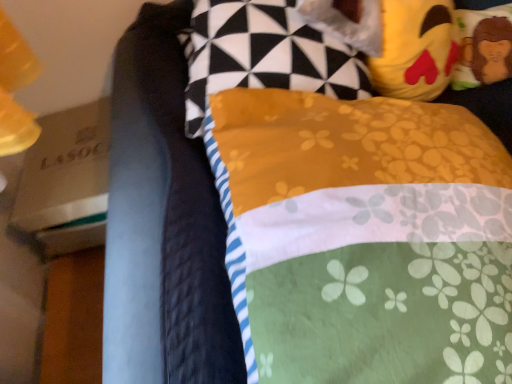
Question: Is yellow fabric pillow at upper center, the 1th pillow when ordered from left to right, taller than yellow plush toy at upper right?

Choices:
 (A) yes
 (B) no

Answer: (A)

Question: From the image's perspective, is yellow fabric pillow at upper center, which appears as the 3th pillow when viewed from the right, under yellow plush toy at upper right?

Choices:
 (A) no
 (B) yes

Answer: (B)

Question: Considering the relative positions of yellow fabric pillow at upper center, the 1th pillow when ordered from left to right, and yellow plush toy at upper right in the image provided, is yellow fabric pillow at upper center, the 1th pillow when ordered from left to right, behind yellow plush toy at upper right?

Choices:
 (A) no
 (B) yes

Answer: (A)

Question: Can you confirm if yellow fabric pillow at upper center, the 1th pillow when ordered from left to right, is shorter than yellow plush toy at upper right?

Choices:
 (A) no
 (B) yes

Answer: (A)

Question: Can you confirm if yellow fabric pillow at upper center, the 1th pillow when ordered from left to right, is thinner than yellow plush toy at upper right?

Choices:
 (A) no
 (B) yes

Answer: (A)

Question: Is yellow fabric pillow at upper right, which is counted as the 2th pillow, starting from the right, bigger or smaller than yellow fabric pillow at upper center, the 1th pillow when ordered from left to right?

Choices:
 (A) big
 (B) small

Answer: (A)

Question: Would you say yellow fabric pillow at upper right, the 2th pillow when ordered from left to right, is to the left or to the right of yellow fabric pillow at upper center, which appears as the 3th pillow when viewed from the right, in the picture?

Choices:
 (A) left
 (B) right

Answer: (B)

Question: From the image's perspective, is yellow fabric pillow at upper right, which is counted as the 2th pillow, starting from the right, above or below yellow fabric pillow at upper center, the 1th pillow when ordered from left to right?

Choices:
 (A) above
 (B) below

Answer: (B)

Question: Which is correct: yellow fabric pillow at upper right, which is counted as the 2th pillow, starting from the right, is inside yellow fabric pillow at upper center, which appears as the 3th pillow when viewed from the right, or outside of it?

Choices:
 (A) outside
 (B) inside

Answer: (A)

Question: From the image's perspective, is yellow fabric pillow at upper center, the 1th pillow when ordered from left to right, above or below yellow plush toy at upper right, the 1th pillow when ordered from right to left?

Choices:
 (A) above
 (B) below

Answer: (B)

Question: Considering the positions of point (266, 72) and point (476, 59), is point (266, 72) closer or farther from the camera than point (476, 59)?

Choices:
 (A) farther
 (B) closer

Answer: (B)

Question: Visually, is yellow fabric pillow at upper center, the 1th pillow when ordered from left to right, positioned to the left or to the right of yellow plush toy at upper right, the 1th pillow when ordered from right to left?

Choices:
 (A) left
 (B) right

Answer: (A)

Question: Looking at the image, does yellow fabric pillow at upper center, the 1th pillow when ordered from left to right, seem bigger or smaller compared to yellow plush toy at upper right, the 1th pillow when ordered from right to left?

Choices:
 (A) big
 (B) small

Answer: (A)

Question: From the image's perspective, relative to yellow plush toy at upper right, is yellow plush toy at upper right, which appears as the 3th pillow when viewed from the left, above or below?

Choices:
 (A) above
 (B) below

Answer: (A)

Question: In the image, is yellow plush toy at upper right, which appears as the 3th pillow when viewed from the left, positioned in front of or behind yellow plush toy at upper right?

Choices:
 (A) front
 (B) behind

Answer: (B)